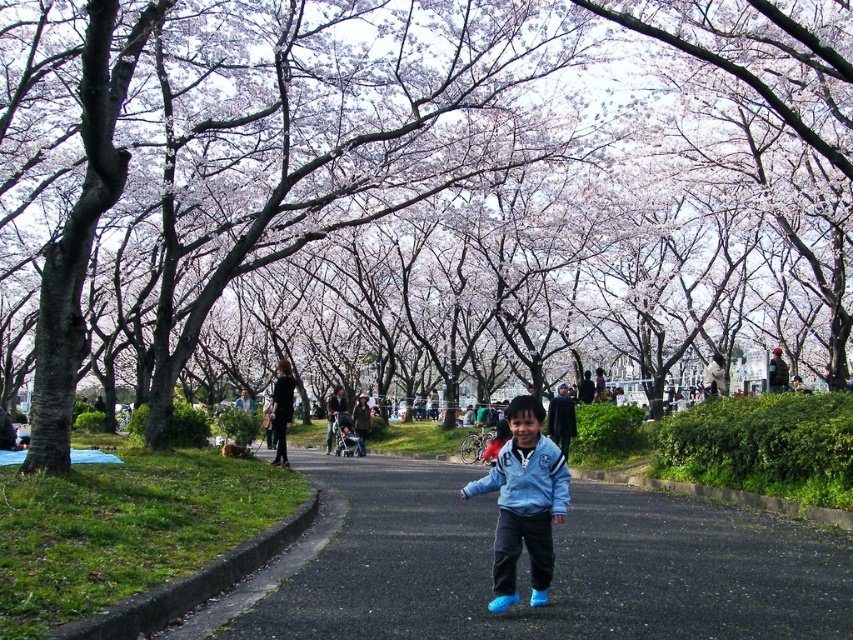
You are a photographer trying to capture two jackets in the park scene. You notice the blue fabric jacket at center and the blue matte jacket at center. Which jacket is positioned more to the right side of the image?

The blue fabric jacket at center is positioned more to the right side of the image compared to the blue matte jacket at center.

You are standing at the point with coordinates point (770, 540) in the park scene. You want to walk to the point with coordinates point (204, 204). Based on the spatial relationship between these two points, which direction should you face to walk towards your destination?

Since point (204, 204) is behind point (770, 540), you should face away from the camera to walk towards point (204, 204).